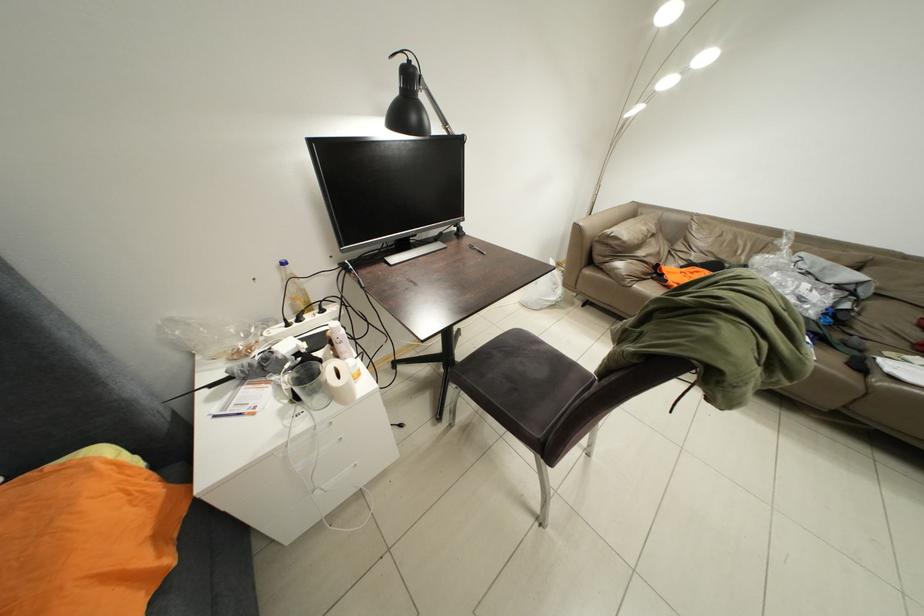
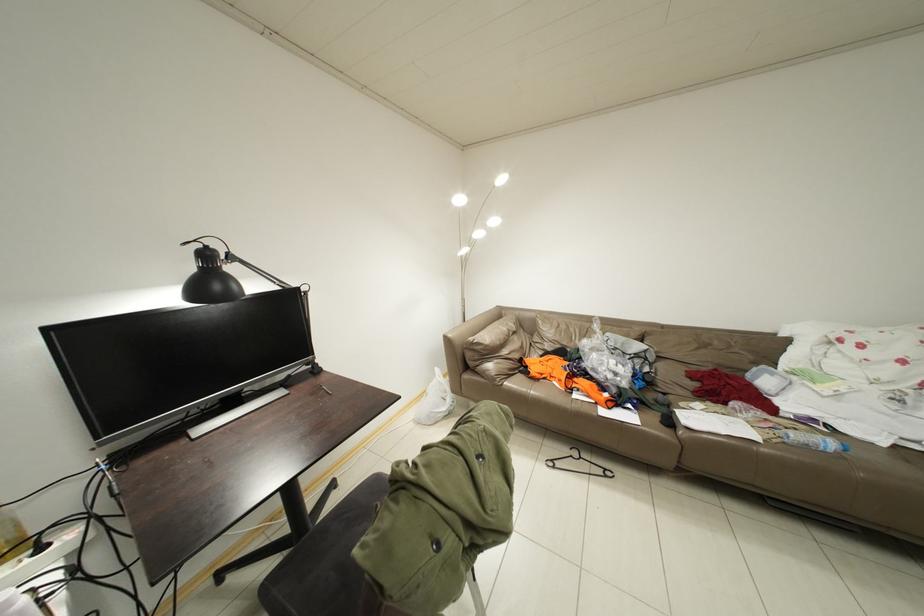
In the scene shown: First-person continuous shooting, in which direction is the camera rotating?

The camera rotated toward right-up.